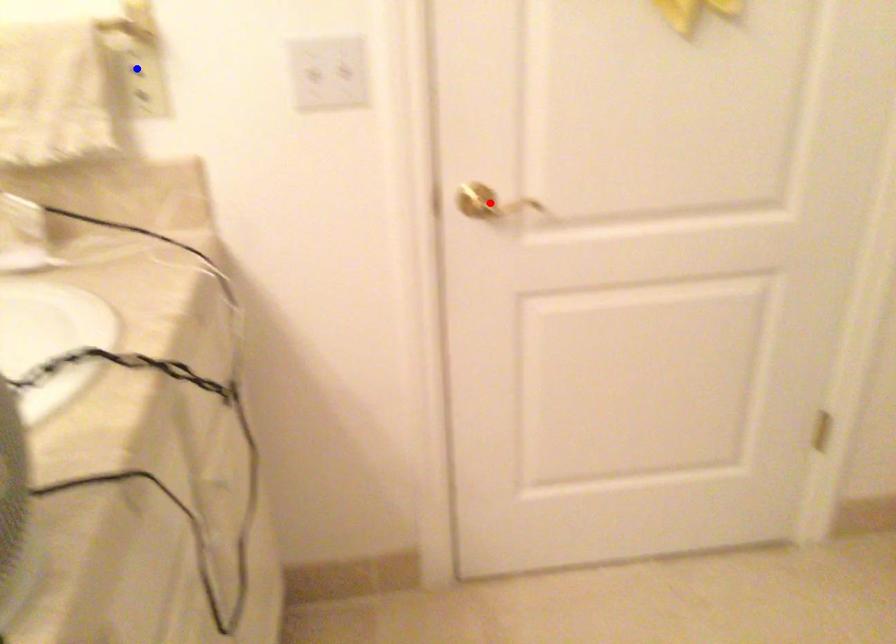
Question: Two points are marked on the image. Which point is closer to the camera?

Choices:
 (A) Blue point is closer.
 (B) Red point is closer.

Answer: (A)